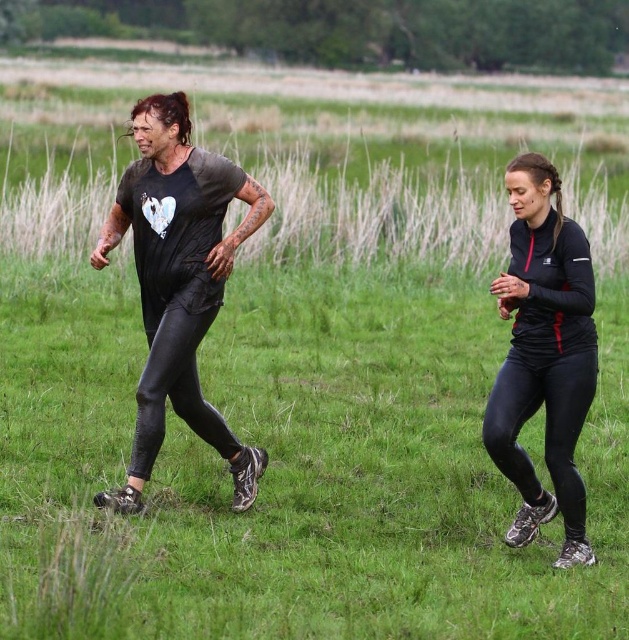
Question: Which object appears farthest from the camera in this image?

Choices:
 (A) matte black t-shirt at left
 (B) matte black leggings at left

Answer: (B)

Question: Which object is positioned closest to the black matte leggings at right?

Choices:
 (A) matte black t-shirt at left
 (B) matte black leggings at left

Answer: (B)

Question: Can you confirm if matte black t-shirt at left is wider than black matte leggings at right?

Choices:
 (A) yes
 (B) no

Answer: (A)

Question: Which of these objects is positioned closest to the matte black t-shirt at left?

Choices:
 (A) matte black leggings at left
 (B) black matte leggings at right

Answer: (A)

Question: Does matte black leggings at left come behind black matte leggings at right?

Choices:
 (A) no
 (B) yes

Answer: (B)

Question: Is matte black leggings at left behind black matte leggings at right?

Choices:
 (A) yes
 (B) no

Answer: (A)